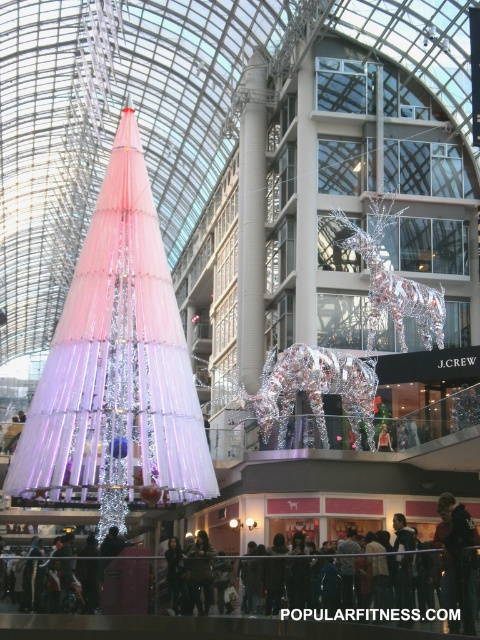
You are a photographer trying to capture both the shiny metallic reindeer at center and the silver metallic reindeer at center in a single frame. Since you want to highlight the bigger one, which reindeer should you focus on?

The shiny metallic reindeer at center is bigger than the silver metallic reindeer at center, so you should focus on the shiny metallic reindeer at center to highlight the bigger one.

You are standing in the shopping area and want to take a photo of both the shiny metallic reindeer at center and the silver metallic reindeer at center. Which one should you adjust your camera focus on first to ensure both are in the frame?

You should focus on the shiny metallic reindeer at center first since it is closer to you than the silver metallic reindeer at center, allowing both to be captured in the frame when adjusted properly.

You are a visitor in the shopping area and want to take a photo with both the shiny metallic reindeer at center and the silver metallic reindeer at center. Which reindeer should you stand closer to in order to include both in your photo frame?

You should stand closer to the shiny metallic reindeer at center since it is shorter than the silver metallic reindeer at center, allowing both to fit within the photo frame.